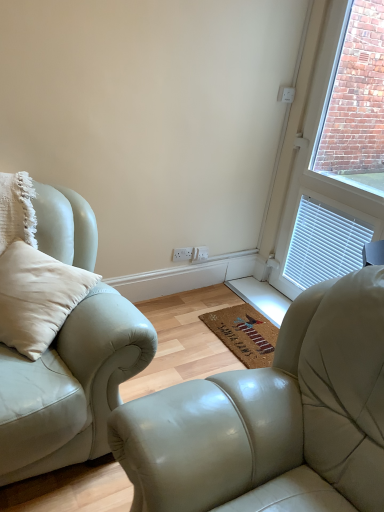
Question: Can you confirm if light beige leather couch at left is positioned to the left of white textured window at upper right?

Choices:
 (A) no
 (B) yes

Answer: (B)

Question: From the image's perspective, does light beige leather couch at left appear higher than white textured window at upper right?

Choices:
 (A) yes
 (B) no

Answer: (B)

Question: Are light beige leather couch at left and white textured window at upper right far apart?

Choices:
 (A) yes
 (B) no

Answer: (A)

Question: Does light beige leather couch at left have a lesser width compared to white textured window at upper right?

Choices:
 (A) no
 (B) yes

Answer: (A)

Question: Can you confirm if light beige leather couch at left is bigger than white textured window at upper right?

Choices:
 (A) yes
 (B) no

Answer: (B)

Question: Is light beige leather couch at left touching white textured window at upper right?

Choices:
 (A) no
 (B) yes

Answer: (A)

Question: Considering the relative sizes of white plastic electric outlet at center and light beige leather couch at left in the image provided, is white plastic electric outlet at center taller than light beige leather couch at left?

Choices:
 (A) no
 (B) yes

Answer: (A)

Question: Is light beige leather couch at left located within white plastic electric outlet at center?

Choices:
 (A) no
 (B) yes

Answer: (A)

Question: Is the position of white plastic electric outlet at center less distant than that of light beige leather couch at left?

Choices:
 (A) no
 (B) yes

Answer: (A)

Question: From the image's perspective, does white plastic electric outlet at center appear lower than light beige leather couch at left?

Choices:
 (A) yes
 (B) no

Answer: (B)

Question: Can you confirm if white plastic electric outlet at center is wider than light beige leather couch at left?

Choices:
 (A) no
 (B) yes

Answer: (A)

Question: Is white plastic electric outlet at center looking in the opposite direction of light beige leather couch at left?

Choices:
 (A) yes
 (B) no

Answer: (B)

Question: Is white textured window at upper right closer to the viewer compared to coir mat at center?

Choices:
 (A) yes
 (B) no

Answer: (A)